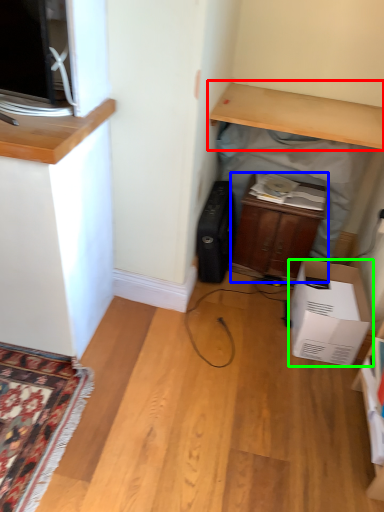
Question: Estimate the real-world distances between objects in this image. Which object is farther from desk (highlighted by a red box), cabinetry (highlighted by a blue box) or cardboard box (highlighted by a green box)?

Choices:
 (A) cabinetry
 (B) cardboard box

Answer: (B)